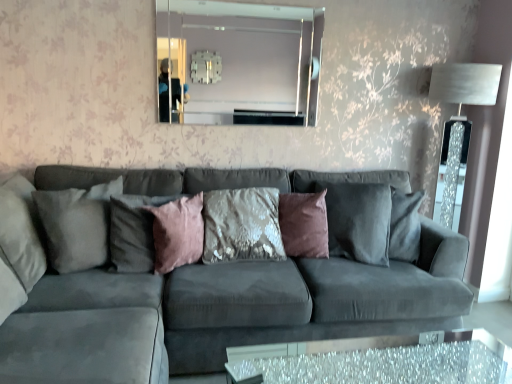
Measure the distance between point (280,34) and camera.

The depth of point (280,34) is 2.71 meters.

Find the location of a particular element. The image size is (512, 384). pink velvet pillow at center, the 2th pillow positioned from the left is located at coordinates (134, 232).

Locate an element on the screen. This screenshot has height=384, width=512. suede gray couch at center is located at coordinates (203, 288).

Where is `sparkly glass table at lower center`? sparkly glass table at lower center is located at coordinates (380, 360).

From a real-world perspective, is velvet sequined pillow at center, which is the 1th pillow in right-to-left order, physically above velvet pink pillow at center, marked as the 2th pillow in a right-to-left arrangement?

Indeed, from a real-world perspective, velvet sequined pillow at center, which is the 1th pillow in right-to-left order, stands above velvet pink pillow at center, marked as the 2th pillow in a right-to-left arrangement.

Between velvet sequined pillow at center, which is the 1th pillow in right-to-left order, and velvet pink pillow at center, marked as the 2th pillow in a right-to-left arrangement, which one has smaller size?

With smaller size is velvet pink pillow at center, marked as the 2th pillow in a right-to-left arrangement.

Which object is positioned more to the left, velvet sequined pillow at center, which is the 4th pillow from left to right, or velvet pink pillow at center, marked as the 2th pillow in a right-to-left arrangement?

From the viewer's perspective, velvet pink pillow at center, marked as the 2th pillow in a right-to-left arrangement, appears more on the left side.

Based on the photo, is velvet sequined pillow at center, which is the 1th pillow in right-to-left order, outside of velvet pink pillow at center, the third pillow when ordered from left to right?

Yes.

Considering the sizes of objects suede gray couch at center and sparkly glass table at lower center in the image provided, who is bigger, suede gray couch at center or sparkly glass table at lower center?

Bigger between the two is suede gray couch at center.

Is suede gray couch at center taller or shorter than sparkly glass table at lower center?

suede gray couch at center is taller than sparkly glass table at lower center.

Which object is positioned more to the left, suede gray couch at center or sparkly glass table at lower center?

A: Positioned to the left is suede gray couch at center.

From a real-world perspective, which object rests below the other?

velvet sequined pillow at center, which is the 4th pillow from left to right.

Considering the sizes of objects clear glass mirror at upper center and velvet sequined pillow at center, which is the 1th pillow in right-to-left order, in the image provided, who is thinner, clear glass mirror at upper center or velvet sequined pillow at center, which is the 1th pillow in right-to-left order,?

clear glass mirror at upper center is thinner.

Is clear glass mirror at upper center not within velvet sequined pillow at center, which is the 4th pillow from left to right?

Yes.

Does point (281, 113) appear closer or farther from the camera than point (325, 207)?

Point (281, 113) is positioned farther from the camera compared to point (325, 207).

Between point (176, 249) and point (472, 356), which one is positioned in front?

The point (472, 356) is closer.

Considering the sizes of objects velvet pink pillow at center, the third pillow when ordered from left to right, and sparkly glass table at lower center in the image provided, who is thinner, velvet pink pillow at center, the third pillow when ordered from left to right, or sparkly glass table at lower center?

velvet pink pillow at center, the third pillow when ordered from left to right.

Which object is further away from the camera taking this photo, velvet pink pillow at center, marked as the 2th pillow in a right-to-left arrangement, or sparkly glass table at lower center?

velvet pink pillow at center, marked as the 2th pillow in a right-to-left arrangement.

Looking at this image, how many degrees apart are the facing directions of velvet pink pillow at center, the third pillow when ordered from left to right, and sparkly glass table at lower center?

velvet pink pillow at center, the third pillow when ordered from left to right, and sparkly glass table at lower center are facing 46.7 degrees away from each other.

What's the angular difference between velvet sequined pillow at center, which is the 1th pillow in right-to-left order, and clear glass mirror at upper center's facing directions?

There is a 28-degree angle between the facing directions of velvet sequined pillow at center, which is the 1th pillow in right-to-left order, and clear glass mirror at upper center.

Is velvet sequined pillow at center, which is the 4th pillow from left to right, to the left or to the right of clear glass mirror at upper center in the image?

Based on their positions, velvet sequined pillow at center, which is the 4th pillow from left to right, is located to the right of clear glass mirror at upper center.

In the scene shown: Is velvet sequined pillow at center, which is the 1th pillow in right-to-left order, wider than clear glass mirror at upper center?

Indeed, velvet sequined pillow at center, which is the 1th pillow in right-to-left order, has a greater width compared to clear glass mirror at upper center.

Which of these two, velvet sequined pillow at center, which is the 4th pillow from left to right, or clear glass mirror at upper center, is bigger?

Bigger between the two is velvet sequined pillow at center, which is the 4th pillow from left to right.

Is clear glass mirror at upper center with sparkly glass table at lower center?

No.

Which of these two, clear glass mirror at upper center or sparkly glass table at lower center, stands taller?

Standing taller between the two is clear glass mirror at upper center.

From the image's perspective, between clear glass mirror at upper center and sparkly glass table at lower center, which one is located above?

clear glass mirror at upper center appears higher in the image.

Considering the relative positions of clear glass mirror at upper center and sparkly glass table at lower center in the image provided, is clear glass mirror at upper center to the left of sparkly glass table at lower center from the viewer's perspective?

Indeed, clear glass mirror at upper center is positioned on the left side of sparkly glass table at lower center.

Is pink velvet pillow at center, the 2th pillow positioned from the left, next to clear glass mirror at upper center and touching it?

pink velvet pillow at center, the 2th pillow positioned from the left, is not next to clear glass mirror at upper center, and they're not touching.

From the image's perspective, between pink velvet pillow at center, acting as the third pillow starting from the right, and clear glass mirror at upper center, who is located below?

pink velvet pillow at center, acting as the third pillow starting from the right, is shown below in the image.

Considering the relative positions of pink velvet pillow at center, acting as the third pillow starting from the right, and clear glass mirror at upper center in the image provided, is pink velvet pillow at center, acting as the third pillow starting from the right, behind clear glass mirror at upper center?

No.

From a real-world perspective, is pink velvet pillow at center, acting as the third pillow starting from the right, on top of clear glass mirror at upper center?

No, from a real-world perspective, pink velvet pillow at center, acting as the third pillow starting from the right, is not on top of clear glass mirror at upper center.

Identify the location of pillow to the right of velvet pink pillow at center, marked as the 2th pillow in a right-to-left arrangement. (304, 224).

The image size is (512, 384). In order to click on studio couch in front of the sparkly glass table at lower center in this screenshot , I will do `click(203, 288)`.

Which object lies nearer to the anchor point sparkly glass table at lower center, velvet pink pillow at center, marked as the 2th pillow in a right-to-left arrangement, or suede gray couch at center?

suede gray couch at center is closer to sparkly glass table at lower center.

Estimate the real-world distances between objects in this image. Which object is further from suede gray pillow at left, the fourth pillow viewed from the right, suede gray couch at center or clear glass mirror at upper center?

clear glass mirror at upper center.

Estimate the real-world distances between objects in this image. Which object is further from clear glass mirror at upper center, sparkly glass table at lower center or velvet pink pillow at center, marked as the 2th pillow in a right-to-left arrangement?

Based on the image, sparkly glass table at lower center appears to be further to clear glass mirror at upper center.

When comparing their distances from suede gray couch at center, does suede gray pillow at left, the fourth pillow viewed from the right, or sparkly glass table at lower center seem closer?

The object closer to suede gray couch at center is suede gray pillow at left, the fourth pillow viewed from the right.

Considering their positions, is velvet pink pillow at center, the third pillow when ordered from left to right, positioned closer to suede gray couch at center than clear glass mirror at upper center?

Among the two, velvet pink pillow at center, the third pillow when ordered from left to right, is located nearer to suede gray couch at center.

When comparing their distances from clear glass mirror at upper center, does velvet sequined pillow at center, which is the 4th pillow from left to right, or suede gray pillow at left, acting as the first pillow starting from the left, seem closer?

velvet sequined pillow at center, which is the 4th pillow from left to right, lies closer to clear glass mirror at upper center than the other object.

Looking at the image, which one is located further to suede gray couch at center, velvet sequined pillow at center, which is the 4th pillow from left to right, or pink velvet pillow at center, acting as the third pillow starting from the right?

velvet sequined pillow at center, which is the 4th pillow from left to right.

When comparing their distances from suede gray couch at center, does pink velvet pillow at center, acting as the third pillow starting from the right, or velvet pink pillow at center, the third pillow when ordered from left to right, seem closer?

velvet pink pillow at center, the third pillow when ordered from left to right, is closer to suede gray couch at center.

The image size is (512, 384). Identify the location of pillow located between pink velvet pillow at center, the 2th pillow positioned from the left, and velvet sequined pillow at center, which is the 1th pillow in right-to-left order, in the left-right direction. (178, 233).

The image size is (512, 384). In order to click on table between suede gray couch at center and velvet pink pillow at center, marked as the 2th pillow in a right-to-left arrangement, in the front-back direction in this screenshot , I will do `click(380, 360)`.

At what (x,y) coordinates should I click in order to perform the action: click on table located between suede gray couch at center and clear glass mirror at upper center in the depth direction. Please return your answer as a coordinate pair (x, y). The image size is (512, 384). Looking at the image, I should click on (380, 360).

You are a GUI agent. You are given a task and a screenshot of the screen. Output one action in this format:
    pyautogui.click(x=<x>, y=<y>)
    Task: Click on the table between suede gray couch at center and suede gray pillow at left, acting as the first pillow starting from the left, from front to back
    This screenshot has width=512, height=384.
    Given the screenshot: What is the action you would take?
    pyautogui.click(x=380, y=360)